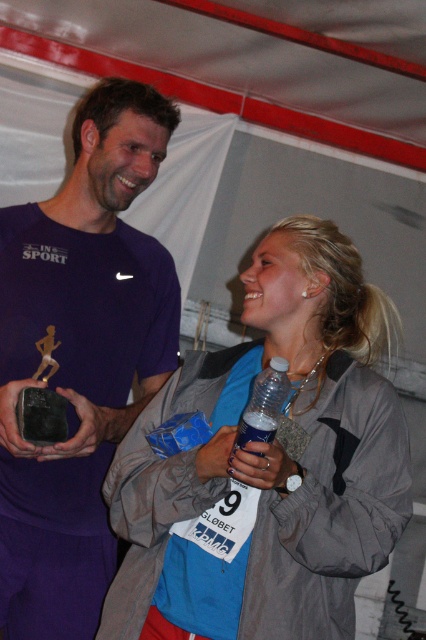
Is gray fabric jacket at center closer to camera compared to blue matte water bottle at center?

No, it is not.

Between gray fabric jacket at center and blue matte water bottle at center, which one is positioned higher?

gray fabric jacket at center is higher up.

Locate an element on the screen. The height and width of the screenshot is (640, 426). gray fabric jacket at center is located at coordinates (287, 477).

Which is in front, point (256, 422) or point (3, 401)?

Positioned in front is point (256, 422).

At what (x,y) coordinates should I click in order to perform the action: click on clear plastic bottle at center. Please return your answer as a coordinate pair (x, y). The height and width of the screenshot is (640, 426). Looking at the image, I should click on (261, 419).

Between gray fabric jacket at center and matte purple shirt at center, which one has less height?

gray fabric jacket at center is shorter.

Where is `gray fabric jacket at center`? The height and width of the screenshot is (640, 426). gray fabric jacket at center is located at coordinates (287, 477).

Is point (213, 556) in front of point (77, 108)?

Yes, point (213, 556) is closer to viewer.

Find the location of a particular element. gray fabric jacket at center is located at coordinates (287, 477).